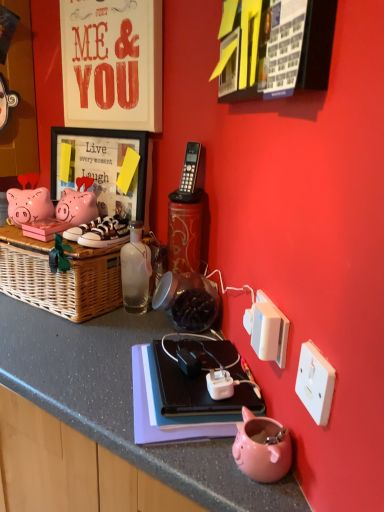
Question: Is transparent glass bottle at center located within white plastic power plugs and sockets at right?

Choices:
 (A) yes
 (B) no

Answer: (B)

Question: From the image's perspective, would you say white plastic power plugs and sockets at right is shown under transparent glass bottle at center?

Choices:
 (A) yes
 (B) no

Answer: (A)

Question: Is white plastic power plugs and sockets at right closer to the viewer compared to transparent glass bottle at center?

Choices:
 (A) no
 (B) yes

Answer: (B)

Question: Is white plastic power plugs and sockets at right shorter than transparent glass bottle at center?

Choices:
 (A) no
 (B) yes

Answer: (B)

Question: Is white plastic power plugs and sockets at right oriented towards transparent glass bottle at center?

Choices:
 (A) yes
 (B) no

Answer: (B)

Question: Would you say white plastic power outlet at lower right, which is counted as the 2th power outlet, starting from the front, is to the left or to the right of transparent glass bottle at center in the picture?

Choices:
 (A) right
 (B) left

Answer: (A)

Question: Considering their positions, is white plastic power outlet at lower right, which is counted as the 2th power outlet, starting from the front, located in front of or behind transparent glass bottle at center?

Choices:
 (A) behind
 (B) front

Answer: (B)

Question: In terms of width, does white plastic power outlet at lower right, which is counted as the 2th power outlet, starting from the front, look wider or thinner when compared to transparent glass bottle at center?

Choices:
 (A) wide
 (B) thin

Answer: (B)

Question: Considering the positions of white plastic power outlet at lower right, which appears as the 2th power outlet when viewed from the right, and transparent glass bottle at center in the image, is white plastic power outlet at lower right, which appears as the 2th power outlet when viewed from the right, bigger or smaller than transparent glass bottle at center?

Choices:
 (A) small
 (B) big

Answer: (A)

Question: From the image's perspective, is white plastic power outlet at lower right, which is counted as the 2th power outlet, starting from the front, positioned above or below white leather sneakers at left, positioned as the first footwear in left-to-right order?

Choices:
 (A) above
 (B) below

Answer: (B)

Question: Is white plastic power outlet at lower right, which is counted as the 2th power outlet, starting from the front, situated inside white leather sneakers at left, placed as the second footwear when sorted from right to left, or outside?

Choices:
 (A) inside
 (B) outside

Answer: (B)

Question: In the image, is white plastic power outlet at lower right, which appears as the 1th power outlet when viewed from the left, positioned in front of or behind white leather sneakers at left, positioned as the first footwear in left-to-right order?

Choices:
 (A) front
 (B) behind

Answer: (A)

Question: Considering the positions of white plastic power outlet at lower right, which ranks as the first power outlet in back-to-front order, and white leather sneakers at left, positioned as the first footwear in left-to-right order, in the image, is white plastic power outlet at lower right, which ranks as the first power outlet in back-to-front order, taller or shorter than white leather sneakers at left, positioned as the first footwear in left-to-right order,?

Choices:
 (A) tall
 (B) short

Answer: (B)

Question: Would you say matte black picture frame at upper left is to the left or to the right of white plastic power outlet at lower right, which is counted as the 2th power outlet, starting from the left, in the picture?

Choices:
 (A) left
 (B) right

Answer: (A)

Question: Looking at their shapes, would you say matte black picture frame at upper left is wider or thinner than white plastic power outlet at lower right, marked as the second power outlet in a back-to-front arrangement?

Choices:
 (A) wide
 (B) thin

Answer: (A)